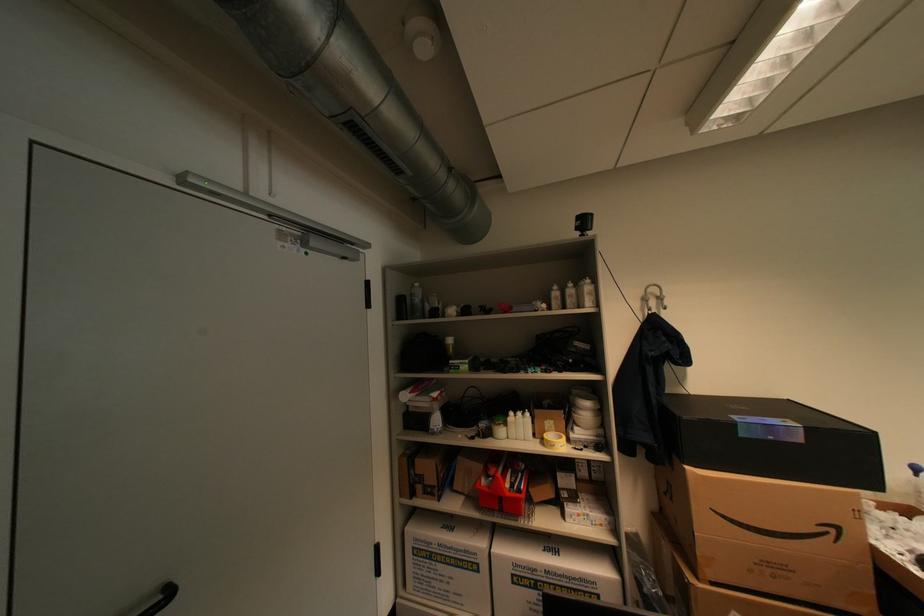
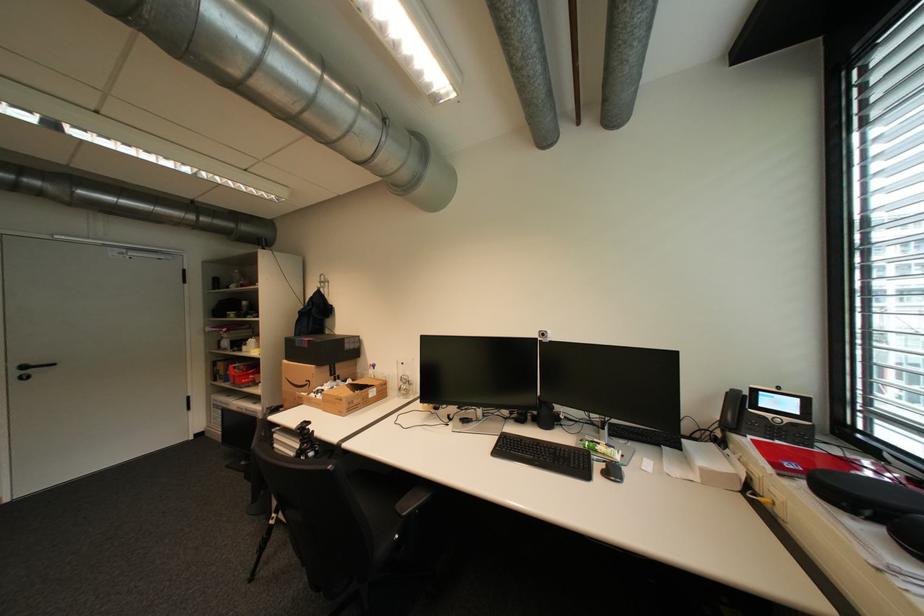
In the second image, find the point that corresponds to point 841,531 in the first image.

(317, 383)